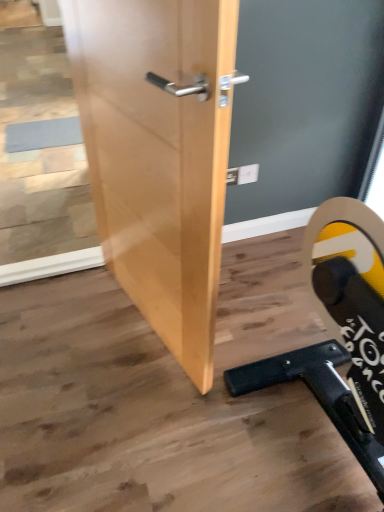
Find the location of a particular element. free space in front of natural wood door at center is located at coordinates (138, 422).